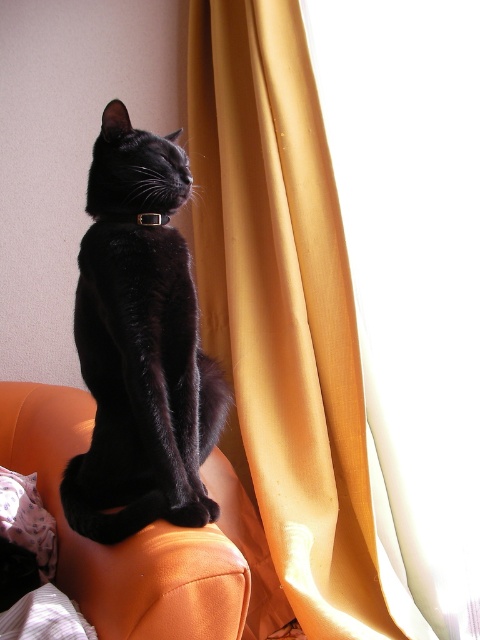
You are a cat owner trying to clean the golden velvet curtain at right while the matte black cat at center is sitting on the chair. If the cat stays put, can you reach the curtain without the cat getting in the way?

The golden velvet curtain at right is 18.48 inches away from the matte black cat at center, so yes, you can reach the curtain without the cat getting in the way since the distance is sufficient.

You are a photographer trying to capture the golden velvet curtain at right and the orange leather couch at upper center in a single shot. The camera you are using has a maximum focus range of 23 inches. Can you focus on both objects simultaneously?

The golden velvet curtain at right is 22.89 inches from the orange leather couch at upper center. Since the distance between them is within the camera maximum focus range of 23 inches, you can focus on both objects simultaneously.